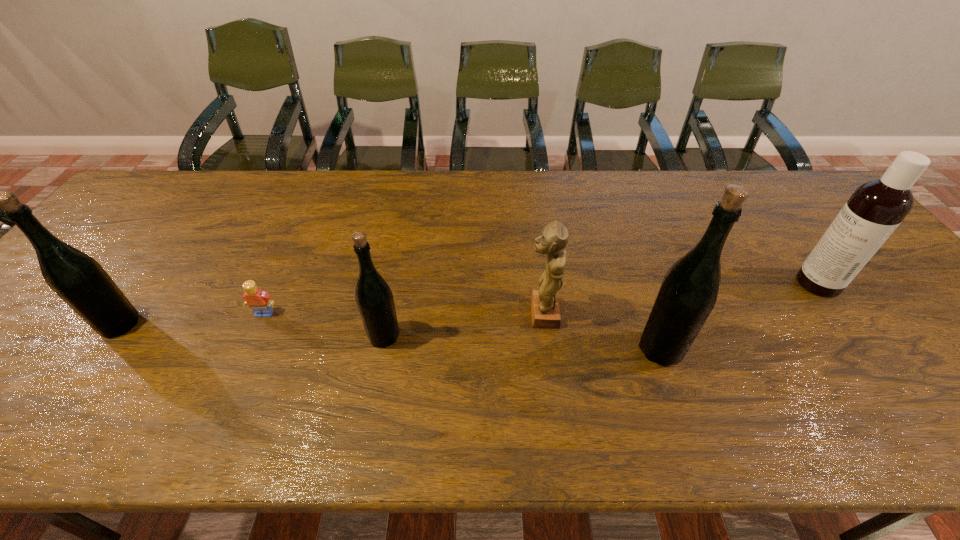
Locate an element on the screen. The image size is (960, 540). vacant region located 0.300m on the back of the second beer bottle from right to left is located at coordinates (402, 240).

I want to click on vacant space situated on the back of the rightmost beer bottle, so click(x=629, y=254).

The height and width of the screenshot is (540, 960). I want to click on blank area located 0.180m on the label side of the rightmost object, so click(x=729, y=284).

Find the location of `vacant region located 0.140m on the label side of the rightmost object`. vacant region located 0.140m on the label side of the rightmost object is located at coordinates (744, 284).

Where is `vacant space located on the label side of the rightmost object`? Image resolution: width=960 pixels, height=540 pixels. vacant space located on the label side of the rightmost object is located at coordinates (779, 284).

The height and width of the screenshot is (540, 960). In order to click on free space located 0.150m on the front-facing side of the figurine in this screenshot , I will do `click(465, 313)`.

Image resolution: width=960 pixels, height=540 pixels. In order to click on vacant position located on the front-facing side of the figurine in this screenshot , I will do `click(490, 313)`.

Identify the location of vacant point located on the front-facing side of the figurine. Image resolution: width=960 pixels, height=540 pixels. (436, 313).

Identify the location of free space located on the front-facing side of the Lego. The width and height of the screenshot is (960, 540). (249, 349).

This screenshot has height=540, width=960. I want to click on object that is at the near edge, so click(688, 293).